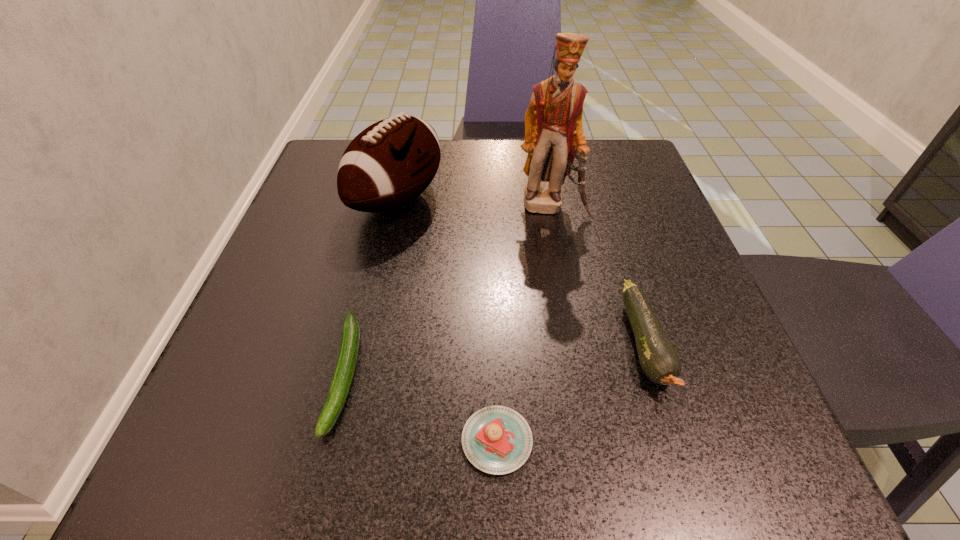
At what (x,y) coordinates should I click in order to perform the action: click on vacant space situated on the left of the third object from left to right. Please return your answer as a coordinate pair (x, y). This screenshot has height=540, width=960. Looking at the image, I should click on (375, 441).

At what (x,y) coordinates should I click in order to perform the action: click on nutcracker located at the far edge. Please return your answer as a coordinate pair (x, y). The height and width of the screenshot is (540, 960). Looking at the image, I should click on (554, 137).

Where is `football (American) that is positioned at the far edge`? football (American) that is positioned at the far edge is located at coordinates (390, 163).

Locate an element on the screen. This screenshot has width=960, height=540. zucchini present at the near edge is located at coordinates (348, 353).

You are a GUI agent. You are given a task and a screenshot of the screen. Output one action in this format:
    pyautogui.click(x=<x>, y=<y>)
    Task: Click on the pastry that is at the near edge
    The image size is (960, 540).
    Given the screenshot: What is the action you would take?
    [497, 440]

In order to click on object that is positioned at the left edge in this screenshot , I will do (390, 163).

Identify the location of nutcracker at the right edge. (554, 137).

Where is `zucchini at the right edge`? zucchini at the right edge is located at coordinates (659, 360).

Locate an element on the screen. This screenshot has width=960, height=540. object that is at the far left corner is located at coordinates (390, 163).

At what (x,y) coordinates should I click in order to perform the action: click on object that is at the far right corner. Please return your answer as a coordinate pair (x, y). The width and height of the screenshot is (960, 540). Looking at the image, I should click on (554, 137).